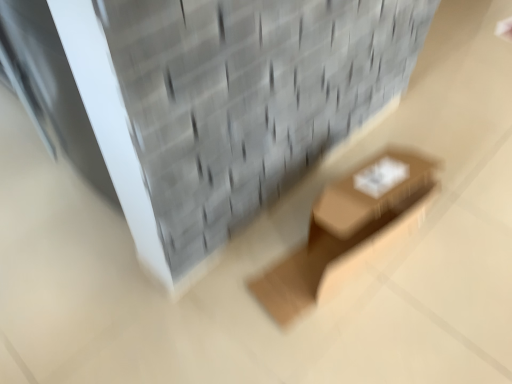
Question: From the image's perspective, is gray textured brickwork at upper center located above or below brown cardboard box at center?

Choices:
 (A) below
 (B) above

Answer: (B)

Question: From a real-world perspective, is gray textured brickwork at upper center positioned above or below brown cardboard box at center?

Choices:
 (A) below
 (B) above

Answer: (A)

Question: Considering their positions, is gray textured brickwork at upper center located in front of or behind brown cardboard box at center?

Choices:
 (A) front
 (B) behind

Answer: (A)

Question: Is brown cardboard box at center wider or thinner than gray textured brickwork at upper center?

Choices:
 (A) wide
 (B) thin

Answer: (B)

Question: From the image's perspective, relative to gray textured brickwork at upper center, is brown cardboard box at center above or below?

Choices:
 (A) below
 (B) above

Answer: (A)

Question: Is brown cardboard box at center bigger or smaller than gray textured brickwork at upper center?

Choices:
 (A) big
 (B) small

Answer: (B)

Question: Which is correct: brown cardboard box at center is inside gray textured brickwork at upper center, or outside of it?

Choices:
 (A) inside
 (B) outside

Answer: (B)